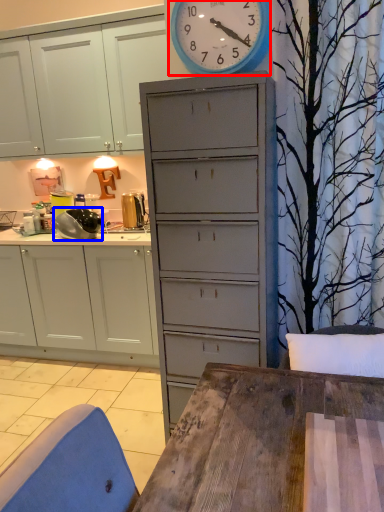
Question: Which object appears closest to the camera in this image, wall clock (highlighted by a red box) or appliance (highlighted by a blue box)?

Choices:
 (A) wall clock
 (B) appliance

Answer: (A)